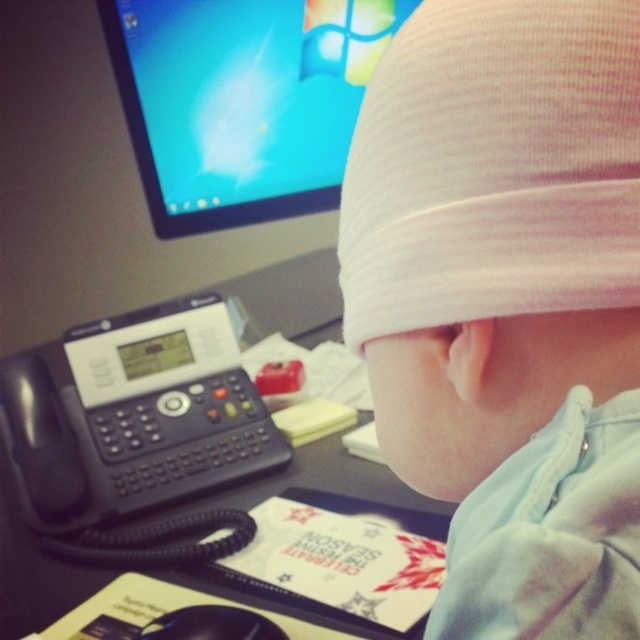
Looking at this image, which is above, white fabric hat at upper center or matte plastic monitor at upper center?

matte plastic monitor at upper center is higher up.

Between white fabric hat at upper center and matte plastic monitor at upper center, which one appears on the left side from the viewer's perspective?

Positioned to the left is matte plastic monitor at upper center.

This screenshot has height=640, width=640. What are the coordinates of `white fabric hat at upper center` in the screenshot? It's located at (492, 228).

I want to click on white fabric hat at upper center, so click(492, 228).

Consider the image. Does black plastic phone at left come behind black plastic phone at lower left?

Yes, black plastic phone at left is further from the viewer.

Can you confirm if black plastic phone at left is positioned to the left of black plastic phone at lower left?

Yes, black plastic phone at left is to the left of black plastic phone at lower left.

Does point (160, 500) come behind point (429, 504)?

That is True.

Where is `black plastic phone at left`? The width and height of the screenshot is (640, 640). black plastic phone at left is located at coordinates (132, 424).

Measure the distance between matte plastic monitor at upper center and black plastic phone at left.

matte plastic monitor at upper center and black plastic phone at left are 11.92 inches apart from each other.

Does point (140, 106) come in front of point (228, 328)?

No, it is behind (228, 328).

What do you see at coordinates (243, 100) in the screenshot?
I see `matte plastic monitor at upper center` at bounding box center [243, 100].

In order to click on matte plastic monitor at upper center in this screenshot , I will do `click(243, 100)`.